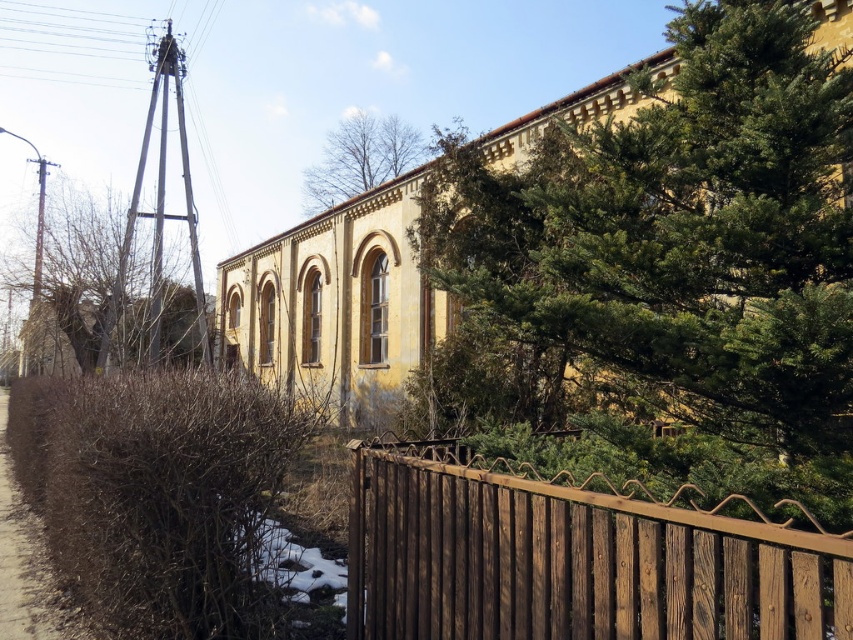
You are standing in front of the yellowish building with arched windows. There is a wooden fence with a metal top rail in the foreground. Where is the green leafy tree at upper right located in the image?

The green leafy tree at upper right is located at point (x=671, y=262) in the image.

You are a landscape architect designing a garden. You have to place a tall statue that needs to be visible from the road. Which object between the green leafy tree at upper right and the brown dirt at left would you place the statue near to ensure it is visible?

The green leafy tree at upper right has a greater height compared to brown dirt at left, so placing the statue near the green leafy tree at upper right would provide a better vantage point for visibility from the road.